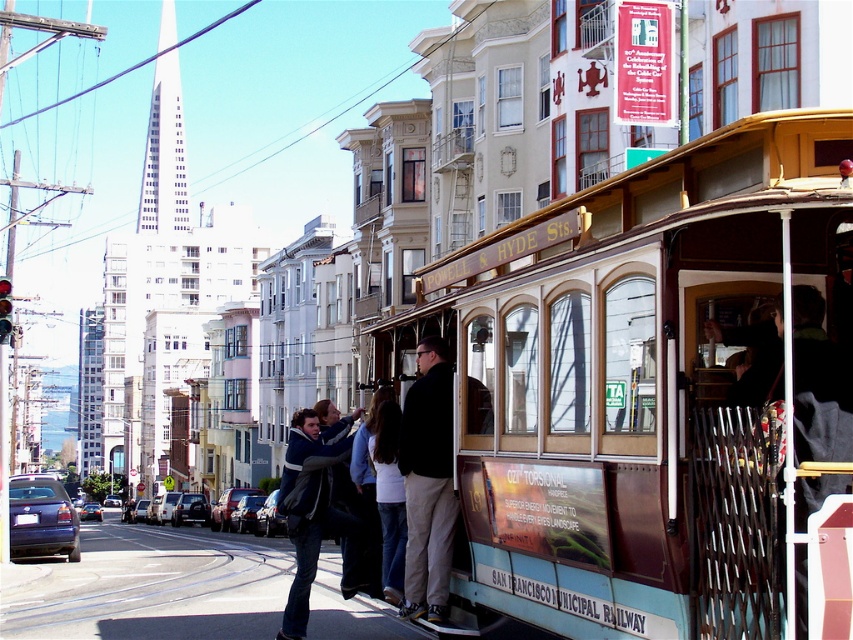
Question: Estimate the real-world distances between objects in this image. Which object is farther from the dark brown leather jacket at center?

Choices:
 (A) denim jacket at lower left
 (B) teal polished wood cable car at center

Answer: (B)

Question: Considering the real-world distances, which object is closest to the denim jacket at lower left?

Choices:
 (A) teal polished wood cable car at center
 (B) dark brown leather jacket at center

Answer: (B)

Question: Which of the following is the closest to the observer?

Choices:
 (A) denim jacket at lower left
 (B) dark brown leather jacket at center

Answer: (B)

Question: Can you confirm if dark brown leather jacket at center is wider than denim jacket at lower left?

Choices:
 (A) no
 (B) yes

Answer: (A)

Question: Is teal polished wood cable car at center positioned before denim jacket at lower left?

Choices:
 (A) yes
 (B) no

Answer: (A)

Question: Does teal polished wood cable car at center appear on the left side of dark brown leather jacket at center?

Choices:
 (A) yes
 (B) no

Answer: (B)